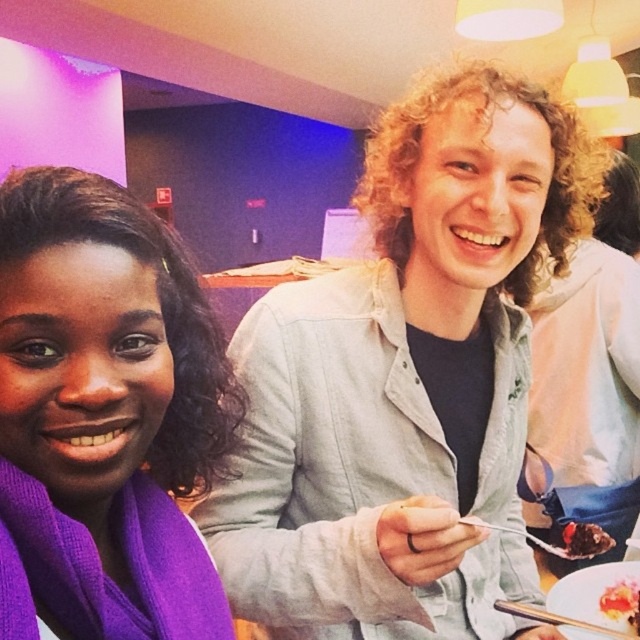
You are a guest at a dinner party and see the white glossy plate at lower right and the chocolate cake at lower right. Which item is placed on top of the other?

The white glossy plate at lower right is positioned over chocolate cake at lower right, so the plate is on top of the cake.

Based on the photo, you are a food delivery person who needs to place a small dessert container on the table without covering any existing items. The table has a white glossy plate at lower right and a chocolate cake at lower right. Can you fit the container between them?

The white glossy plate at lower right is bigger than the chocolate cake at lower right, so there might not be enough space between them to place the container without overlapping.